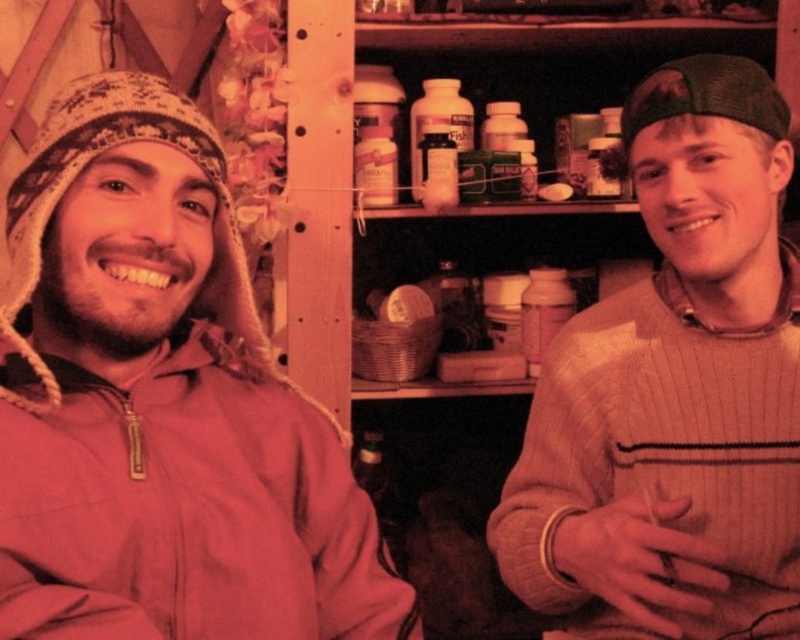
You are a delivery robot that is 16 inches wide. You need to pass between the matte pink jacket at left and the knitted sweater at right. Can you fit through the space between them?

The distance between the matte pink jacket at left and the knitted sweater at right is 16.43 inches. Since the robot is 16 inches wide, it can just barely fit through the space between them.

You are organizing a clothing store and need to arrange the matte pink jacket at left and the knitted sweater at right on a vertical rack. Based on their positions in the image, which garment should be placed lower on the rack?

The matte pink jacket at left should be placed lower on the rack since it is located below the knitted sweater at right in the image.